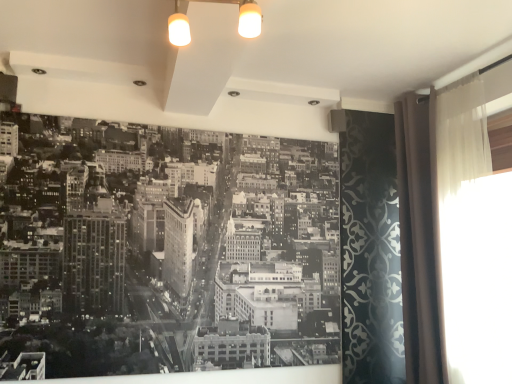
Question: Is the position of beige fabric curtain at right less distant than that of black paper at center?

Choices:
 (A) no
 (B) yes

Answer: (A)

Question: Can you see beige fabric curtain at right touching black paper at center?

Choices:
 (A) yes
 (B) no

Answer: (B)

Question: Can you confirm if beige fabric curtain at right is shorter than black paper at center?

Choices:
 (A) no
 (B) yes

Answer: (A)

Question: From a real-world perspective, is beige fabric curtain at right beneath black paper at center?

Choices:
 (A) no
 (B) yes

Answer: (A)

Question: From the image's perspective, is beige fabric curtain at right located beneath black paper at center?

Choices:
 (A) yes
 (B) no

Answer: (B)

Question: Is beige fabric curtain at right thinner than black paper at center?

Choices:
 (A) no
 (B) yes

Answer: (A)

Question: From the image's perspective, is translucent fabric curtain at right on top of beige fabric curtain at right?

Choices:
 (A) no
 (B) yes

Answer: (B)

Question: Are translucent fabric curtain at right and beige fabric curtain at right far apart?

Choices:
 (A) yes
 (B) no

Answer: (B)

Question: Can you confirm if translucent fabric curtain at right is taller than beige fabric curtain at right?

Choices:
 (A) yes
 (B) no

Answer: (B)

Question: Would you say translucent fabric curtain at right is outside beige fabric curtain at right?

Choices:
 (A) no
 (B) yes

Answer: (B)

Question: Is translucent fabric curtain at right aimed at beige fabric curtain at right?

Choices:
 (A) no
 (B) yes

Answer: (A)

Question: Can you confirm if translucent fabric curtain at right is bigger than beige fabric curtain at right?

Choices:
 (A) yes
 (B) no

Answer: (B)

Question: Can you confirm if black paper at center is positioned to the right of beige fabric curtain at right?

Choices:
 (A) no
 (B) yes

Answer: (A)